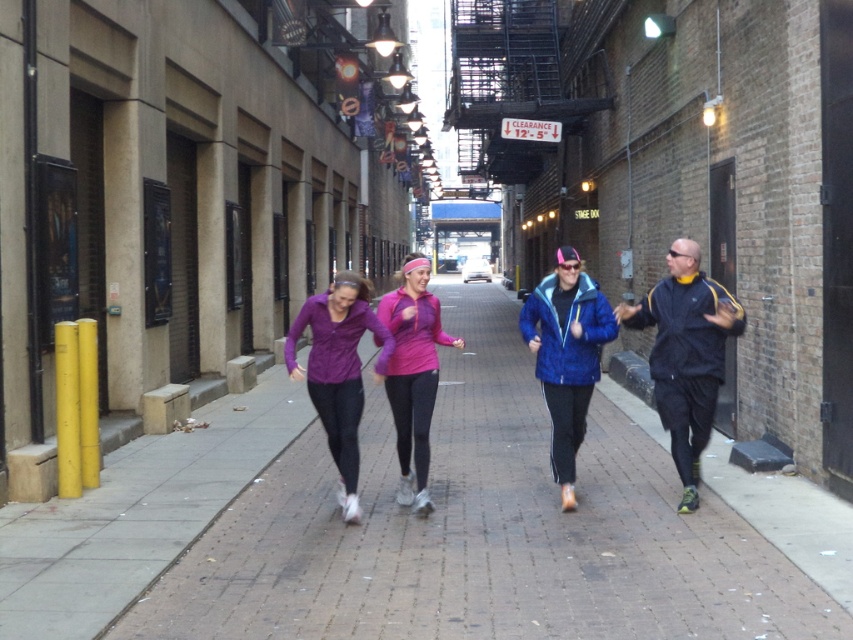
How far apart are dark blue track suit at right and blue matte jacket at center?

dark blue track suit at right is 25.57 inches away from blue matte jacket at center.

Can you confirm if dark blue track suit at right is positioned above blue matte jacket at center?

Yes.

Who is more forward, (701,451) or (561,477)?

Point (701,451) is in front.

I want to click on dark blue track suit at right, so click(685, 355).

Does brick pavement at center have a larger size compared to pink matte headband at center?

Yes.

Describe the element at coordinates (418, 525) in the screenshot. I see `brick pavement at center` at that location.

Identify the location of brick pavement at center. (418, 525).

Does blue matte jacket at center have a greater height compared to pink matte headband at center?

Correct, blue matte jacket at center is much taller as pink matte headband at center.

Who is shorter, blue matte jacket at center or pink matte headband at center?

With less height is pink matte headband at center.

The height and width of the screenshot is (640, 853). What do you see at coordinates (566, 355) in the screenshot? I see `blue matte jacket at center` at bounding box center [566, 355].

Where is `blue matte jacket at center`? The image size is (853, 640). blue matte jacket at center is located at coordinates (566, 355).